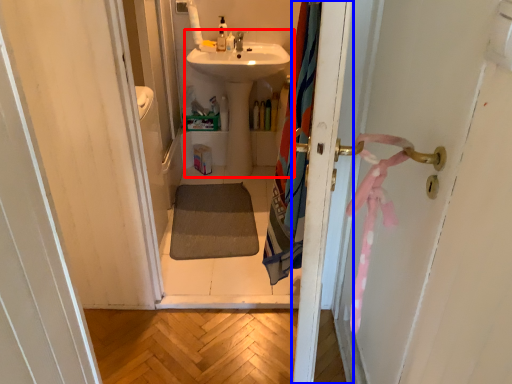
Question: Which of the following is the farthest to the observer, sink (highlighted by a red box) or screen door (highlighted by a blue box)?

Choices:
 (A) sink
 (B) screen door

Answer: (A)